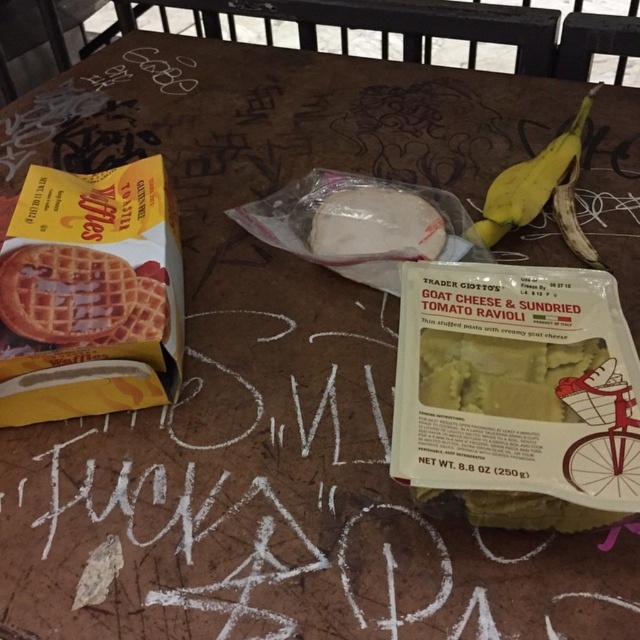
You are planning to serve both the yellow matte waffles at upper left and the golden brown waffle at left on a small plate. Which one might not fit well due to its size?

The yellow matte waffles at upper left has a larger size compared to golden brown waffle at left, so it might not fit well on a small plate.

You are planning to place both the golden brown waffle at left and the white matte ravioli at center into a rectangular container. Which object requires a wider container to fit without overlapping?

The golden brown waffle at left requires a wider container since its width surpasses that of the white matte ravioli at center.